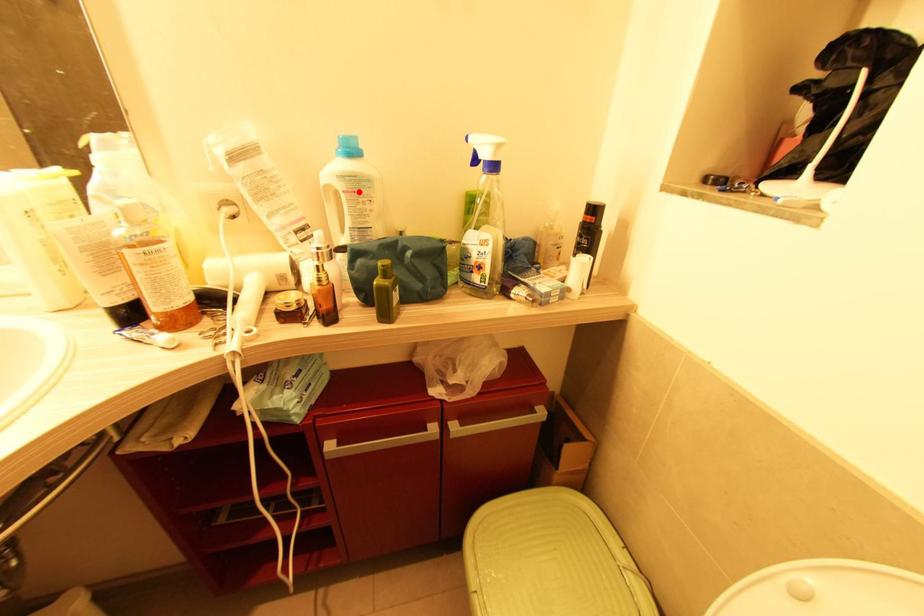
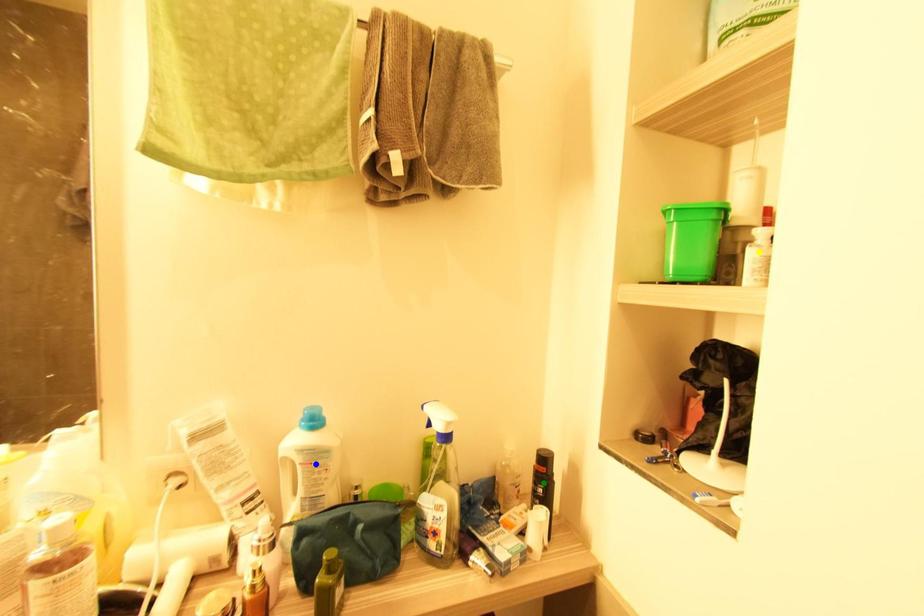
Question: I am providing you with two images of the same scene from different viewpoints. A red point is marked on the first image. You are given multiple points on the second image. Which mark in image 2 goes with the point in image 1?

Choices:
 (A) green point
 (B) yellow point
 (C) blue point

Answer: (C)